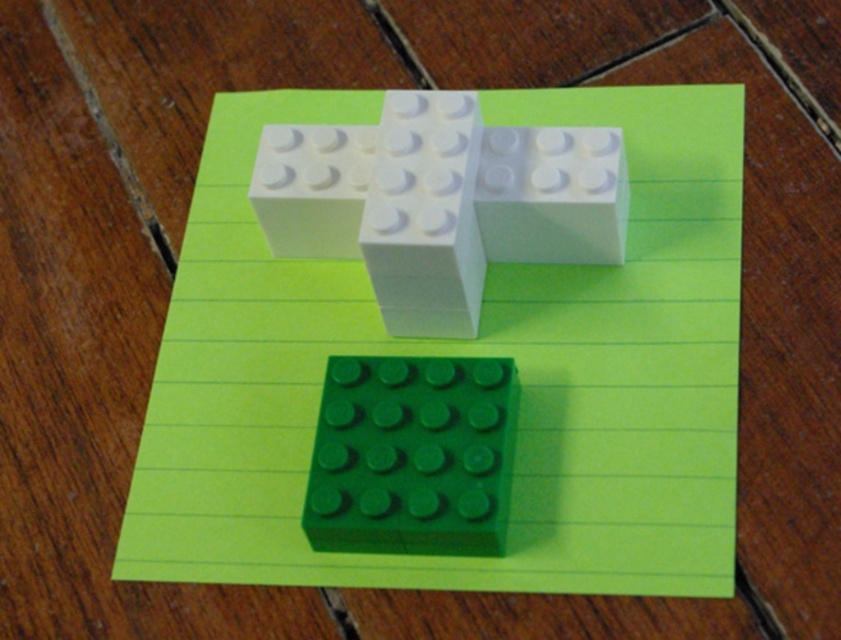
You are looking at the LEGO arrangement on the green lined paper. There are two points marked on the image. One is at point (436,285) and the other is at point (616,35). From your perspective, which point is closer to you?

Point (436,285) is in front of point (616,35), so it is closer to you.

You are trying to stack the white matte plastic blocks at upper center and the white matte block at center on top of each other. Which one should you place at the bottom to ensure stability?

You should place the white matte block at center at the bottom because it is taller than the white matte plastic blocks at upper center, providing a stable base.